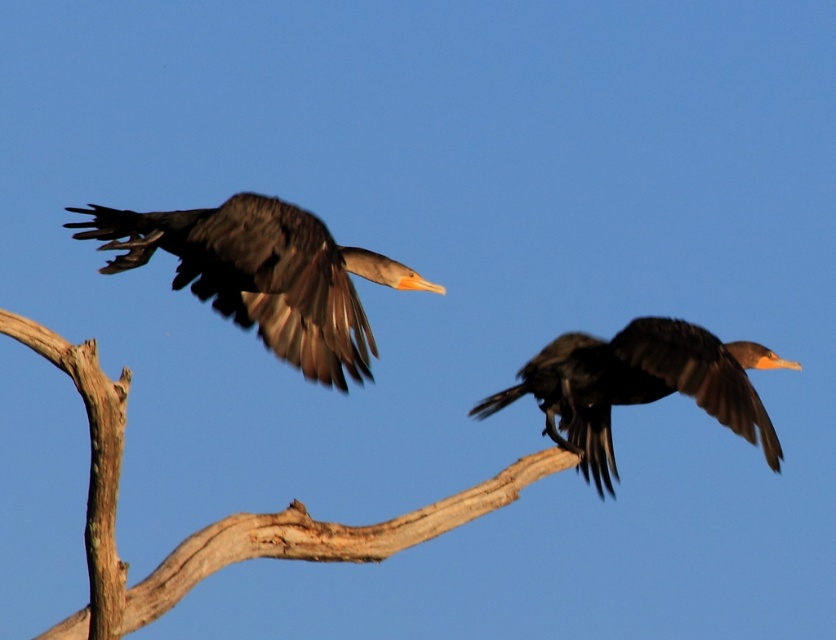
Question: Among these objects, which one is farthest from the camera?

Choices:
 (A) shiny black bird at left
 (B) smooth wood branch at center
 (C) shiny black bird at center

Answer: (C)

Question: Is shiny black bird at left below shiny black bird at center?

Choices:
 (A) yes
 (B) no

Answer: (B)

Question: Does smooth wood branch at center appear over shiny black bird at left?

Choices:
 (A) yes
 (B) no

Answer: (B)

Question: Considering the real-world distances, which object is closest to the shiny black bird at center?

Choices:
 (A) shiny black bird at left
 (B) smooth wood branch at center

Answer: (B)

Question: Is smooth wood branch at center to the left of shiny black bird at center from the viewer's perspective?

Choices:
 (A) yes
 (B) no

Answer: (A)

Question: Among these points, which one is nearest to the camera?

Choices:
 (A) (445, 531)
 (B) (609, 477)

Answer: (A)